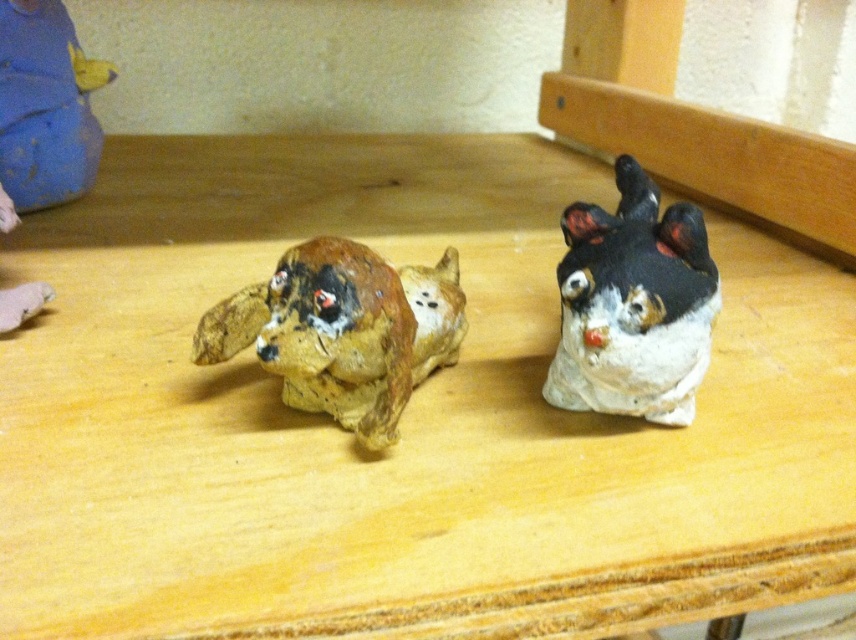
Does brown matte dog at left appear under speckled clay cat at right?

Yes.

Measure the distance from brown matte dog at left to speckled clay cat at right.

brown matte dog at left and speckled clay cat at right are 10.02 inches apart.

What do you see at coordinates (343, 330) in the screenshot? The height and width of the screenshot is (640, 856). I see `brown matte dog at left` at bounding box center [343, 330].

The width and height of the screenshot is (856, 640). Find the location of `brown matte dog at left`. brown matte dog at left is located at coordinates (343, 330).

Is speckled clay cat at right closer to the viewer compared to matte blue plush at upper left?

Yes.

Which is above, speckled clay cat at right or matte blue plush at upper left?

matte blue plush at upper left

Find the location of a particular element. speckled clay cat at right is located at coordinates (633, 305).

Does brown matte dog at left come in front of matte blue plush at upper left?

That is True.

Does brown matte dog at left have a lesser width compared to matte blue plush at upper left?

No.

I want to click on brown matte dog at left, so click(343, 330).